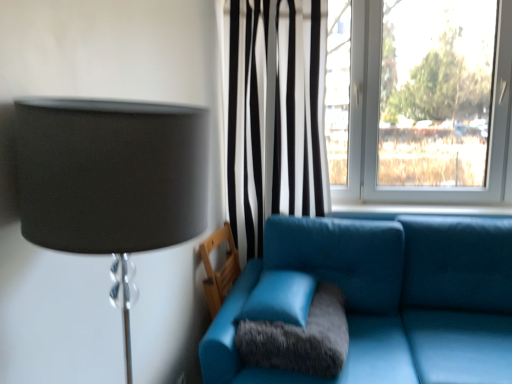
This screenshot has height=384, width=512. Find the location of `blank space situated above matte leather pillow at center (from a real-world perspective)`. blank space situated above matte leather pillow at center (from a real-world perspective) is located at coordinates (283, 272).